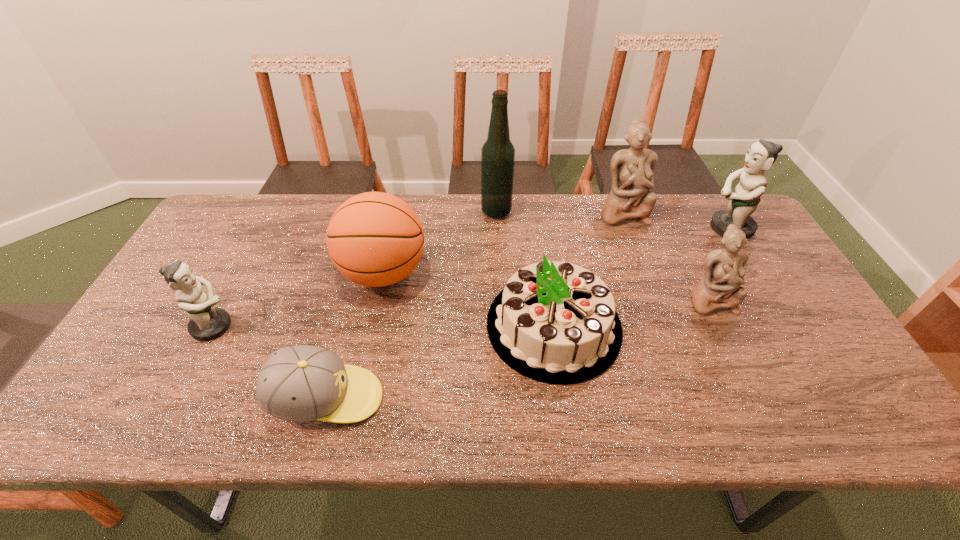
Identify the location of free spot at the left edge of the desktop. The image size is (960, 540). (x=214, y=284).

Where is `vacant point at the right edge`? The height and width of the screenshot is (540, 960). vacant point at the right edge is located at coordinates (785, 337).

I want to click on free area in between the green birthday cake and the leftmost object, so click(x=384, y=326).

Identify the location of free spot between the baseball cap and the green birthday cake. This screenshot has height=540, width=960. (440, 362).

You are a GUI agent. You are given a task and a screenshot of the screen. Output one action in this format:
    pyautogui.click(x=<x>, y=<y>)
    Task: Click on the free space between the seventh object from left to right and the farther white figurine
    
    Given the screenshot: What is the action you would take?
    pyautogui.click(x=666, y=256)

Find the location of `unoccupied position between the nearer white figurine and the bigger white figurine`. unoccupied position between the nearer white figurine and the bigger white figurine is located at coordinates (666, 256).

Locate an element on the screen. The width and height of the screenshot is (960, 540). free point between the third figurine from left to right and the left white figurine is located at coordinates (666, 256).

At what (x,y) coordinates should I click in order to perform the action: click on free area in between the shortest object and the basketball. Please return your answer as a coordinate pair (x, y). Image resolution: width=960 pixels, height=540 pixels. Looking at the image, I should click on (355, 335).

This screenshot has width=960, height=540. Find the location of `object that stands as the second closest to the third figurine from left to right`. object that stands as the second closest to the third figurine from left to right is located at coordinates (554, 322).

What are the coordinates of `the fifth closest object relative to the right green figurine` in the screenshot? It's located at (375, 239).